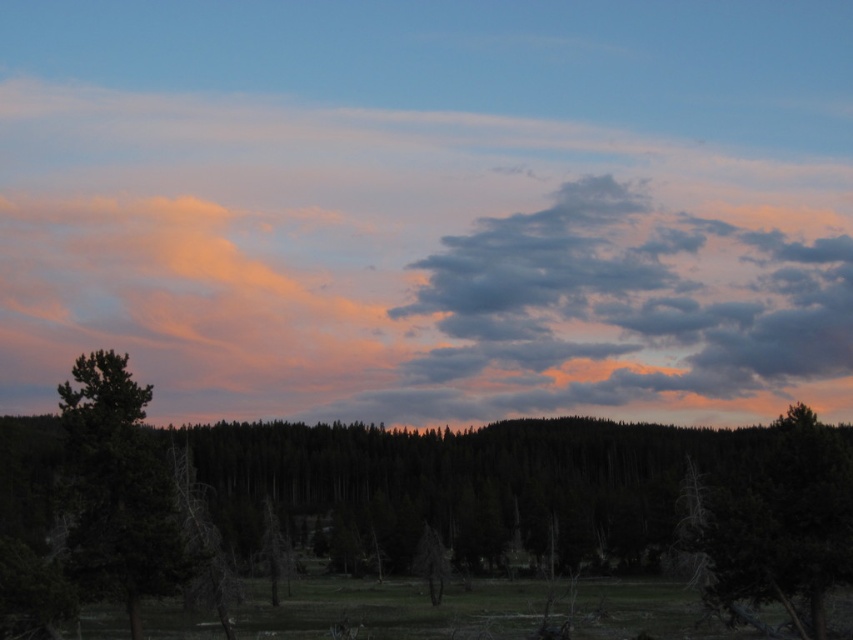
Question: Can you confirm if pastel cotton clouds at center is positioned to the right of green matte tree at left?

Choices:
 (A) no
 (B) yes

Answer: (B)

Question: Among these points, which one is farthest from the camera?

Choices:
 (A) (177, 433)
 (B) (207, 400)

Answer: (B)

Question: Can you confirm if pastel cotton clouds at center is smaller than dark green forest at center?

Choices:
 (A) no
 (B) yes

Answer: (A)

Question: Which is nearer to the green matte tree at left?

Choices:
 (A) green matte tree at center
 (B) dark green forest at center

Answer: (A)

Question: Estimate the real-world distances between objects in this image. Which object is closer to the green matte tree at center?

Choices:
 (A) pastel cotton clouds at center
 (B) dark green forest at center

Answer: (B)

Question: Can you confirm if dark green forest at center is positioned to the right of green matte tree at left?

Choices:
 (A) no
 (B) yes

Answer: (B)